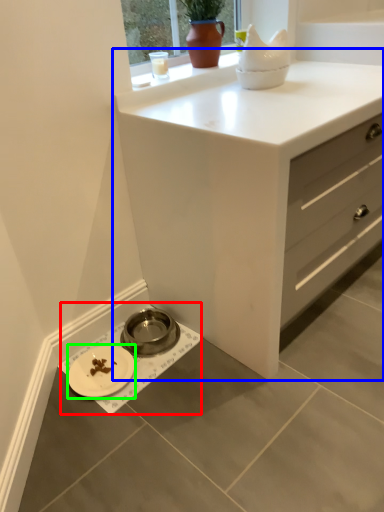
Question: Which object is positioned farthest from sink (highlighted by a red box)? Select from chest of drawers (highlighted by a blue box) and platter (highlighted by a green box).

Choices:
 (A) chest of drawers
 (B) platter

Answer: (A)